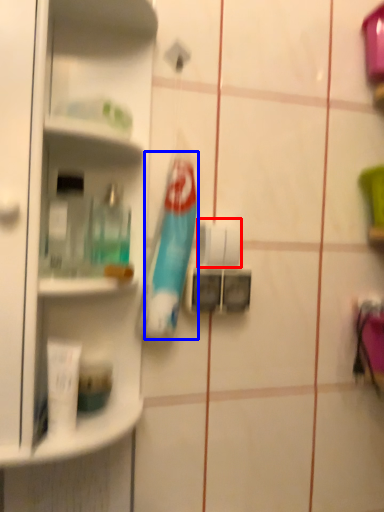
Question: Which object appears closest to the camera in this image, toilet paper (highlighted by a red box) or toothbrush (highlighted by a blue box)?

Choices:
 (A) toilet paper
 (B) toothbrush

Answer: (B)